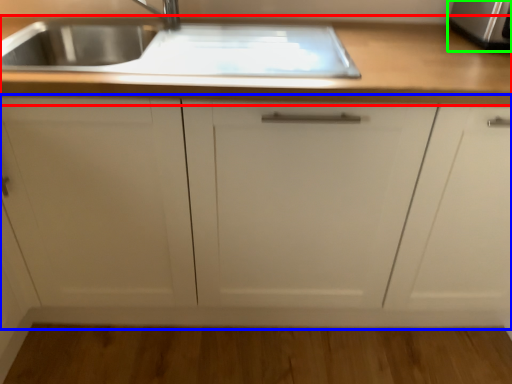
Question: Considering the real-world distances, which object is closest to countertop (highlighted by a red box)? cabinetry (highlighted by a blue box) or stainless steel (highlighted by a green box).

Choices:
 (A) cabinetry
 (B) stainless steel

Answer: (A)